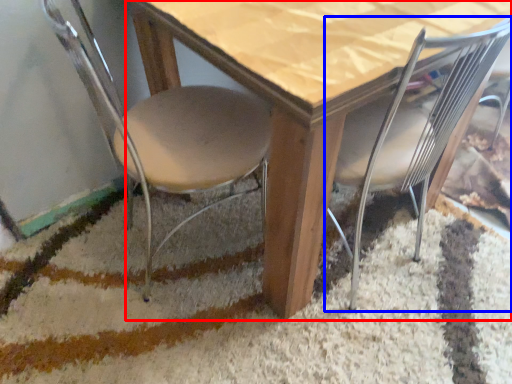
Question: Which point is closer to the camera, table (highlighted by a red box) or chair (highlighted by a blue box)?

Choices:
 (A) table
 (B) chair

Answer: (A)